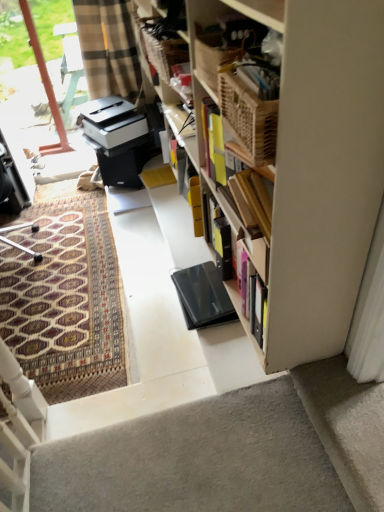
Question: Considering the positions of patterned carpet at left and white plastic printer at center in the image, is patterned carpet at left wider or thinner than white plastic printer at center?

Choices:
 (A) wide
 (B) thin

Answer: (A)

Question: Is patterned carpet at left bigger or smaller than white plastic printer at center?

Choices:
 (A) big
 (B) small

Answer: (A)

Question: Estimate the real-world distances between objects in this image. Which object is farther from the white plastic printer at center?

Choices:
 (A) wooden picnic basket at upper center
 (B) transparent glass door at upper left
 (C) patterned carpet at left
 (D) metallic silver desk at left
 (E) gray carpet at bottom right

Answer: (E)

Question: Estimate the real-world distances between objects in this image. Which object is closer to the transparent glass door at upper left?

Choices:
 (A) black matte laptop at center
 (B) wooden picnic basket at upper center
 (C) white plastic printer at center
 (D) metallic silver desk at left
 (E) gray carpet at bottom right

Answer: (D)